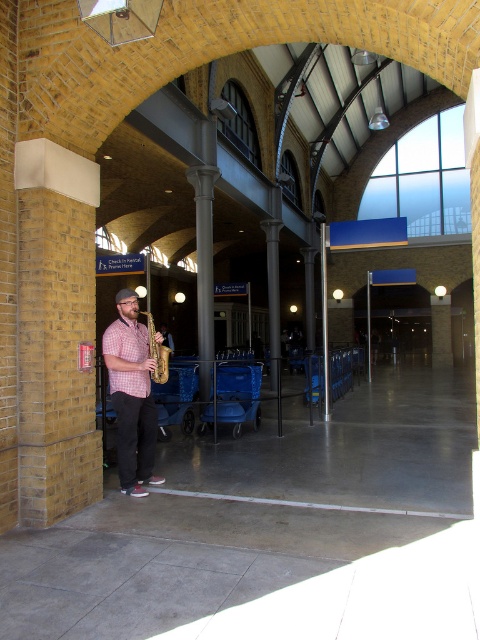
You are a musician carrying a 1.2 meter wide instrument case. You are standing in the train station and see the matte brown saxophone at center and the shiny gold trumpet at center. Can you determine if your case will fit through the space between these two instruments?

The matte brown saxophone at center might be wider than shiny gold trumpet at center. If the saxophone is indeed wider, the space between them may be narrower than 1.2 meters, making it uncertain whether your case will fit. You should check the actual width before attempting to pass through.

You are a musician preparing for a performance in this train station. You have a matte brown saxophone at center and a shiny gold trumpet at center. Which instrument is closer to the large arched windows at the far end of the hall?

The shiny gold trumpet at center is closer to the large arched windows at the far end of the hall because the matte brown saxophone at center is positioned on the left side of it, meaning the trumpet is further towards the right side of the frame where the windows are located.

You are a photographer positioned at the entrance of the train station and want to capture both the matte brown saxophone at center and the shiny gold trumpet at center in your shot. Which instrument will appear larger in the photo?

The matte brown saxophone at center will appear larger in the photo because it is closer to the viewer than the shiny gold trumpet at center.